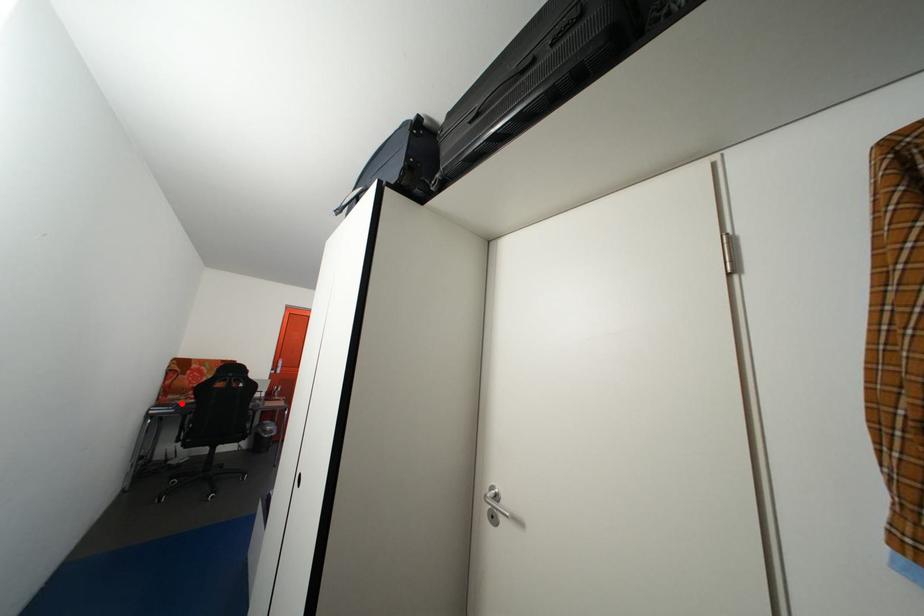
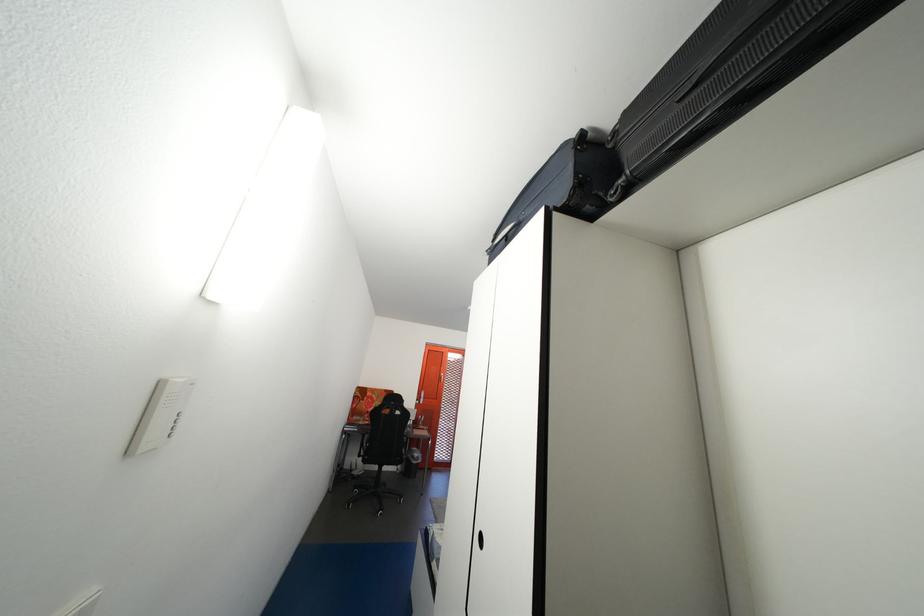
The point at the highlighted location is marked in the first image. Where is the corresponding point in the second image?

(367, 424)